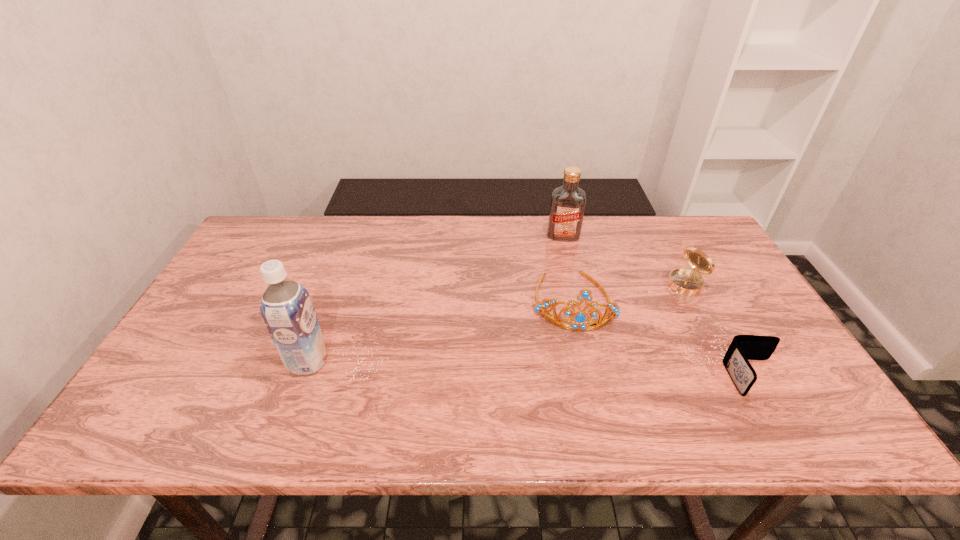
Where is `the leftmost object`? The width and height of the screenshot is (960, 540). the leftmost object is located at coordinates (286, 307).

The height and width of the screenshot is (540, 960). Identify the location of soya milk. (286, 307).

Locate an element on the screen. This screenshot has width=960, height=540. the shortest object is located at coordinates (743, 347).

The height and width of the screenshot is (540, 960). I want to click on vodka, so click(x=567, y=207).

Where is `the second tallest object`? the second tallest object is located at coordinates (567, 207).

At what (x,y) coordinates should I click in order to perform the action: click on the third tallest object. Please return your answer as a coordinate pair (x, y). The image size is (960, 540). Looking at the image, I should click on (580, 318).

Where is `compass`? The height and width of the screenshot is (540, 960). compass is located at coordinates (687, 282).

This screenshot has width=960, height=540. I want to click on vacant position located 0.230m on the label of the soya milk, so click(x=195, y=361).

This screenshot has height=540, width=960. What are the coordinates of `free point located on the label of the soya milk` in the screenshot? It's located at click(x=182, y=361).

The height and width of the screenshot is (540, 960). I want to click on vacant space located 0.090m on the label of the soya milk, so coord(252,361).